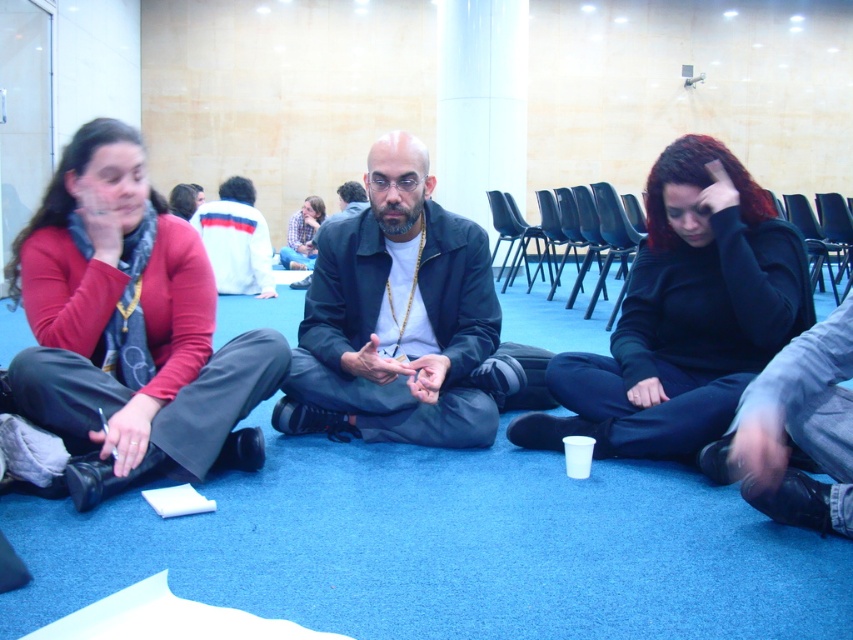
Question: Does black matte jacket at center appear over white cotton jacket at upper center?

Choices:
 (A) no
 (B) yes

Answer: (A)

Question: Which object is the farthest from the plaid shirt at center?

Choices:
 (A) matte red sweater at left
 (B) black matte jacket at center
 (C) white cotton jacket at upper center

Answer: (A)

Question: Estimate the real-world distances between objects in this image. Which object is farther from the black matte hoodie at center?

Choices:
 (A) black matte jacket at center
 (B) plaid shirt at center
 (C) matte red sweater at left

Answer: (B)

Question: Among these points, which one is farthest from the camera?

Choices:
 (A) (289, 266)
 (B) (711, 141)
 (C) (389, 272)

Answer: (A)

Question: Can you confirm if black matte hoodie at center is smaller than white cotton jacket at upper center?

Choices:
 (A) no
 (B) yes

Answer: (A)

Question: From the image, what is the correct spatial relationship of black matte hoodie at center in relation to white cotton jacket at upper center?

Choices:
 (A) right
 (B) left

Answer: (A)